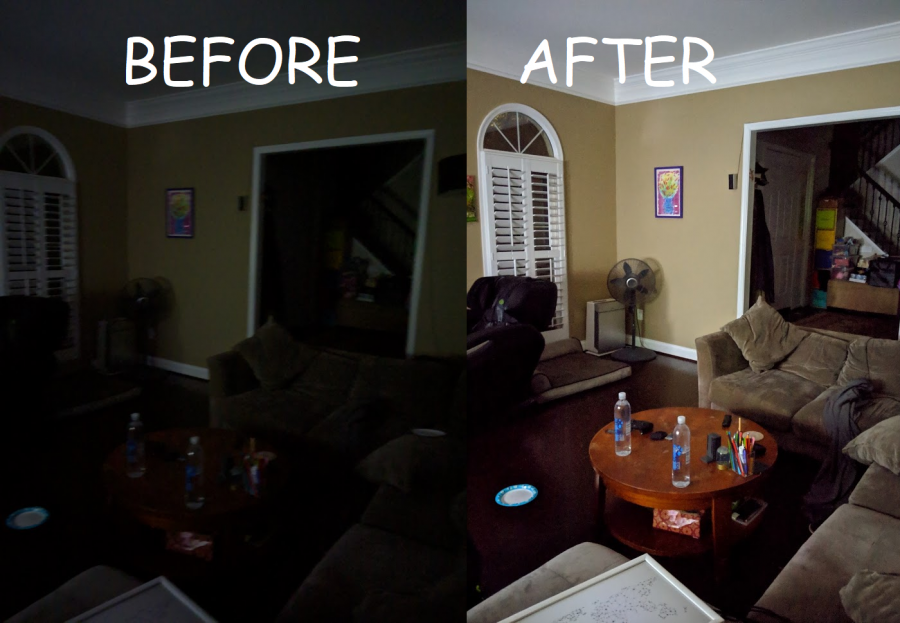
The height and width of the screenshot is (623, 900). I want to click on dark room, so click(x=228, y=134).